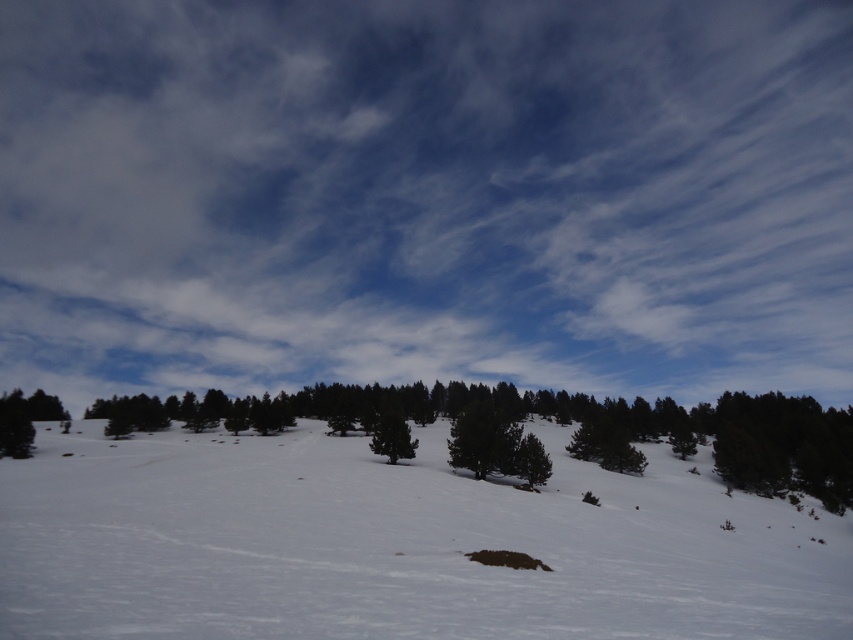
Question: Is white fluffy cloud at upper center positioned before white powdery snow at center?

Choices:
 (A) no
 (B) yes

Answer: (A)

Question: Which point appears farthest from the camera in this image?

Choices:
 (A) (384, 440)
 (B) (440, 51)

Answer: (B)

Question: Which object is positioned farthest from the white powdery snow at center?

Choices:
 (A) white fluffy cloud at upper center
 (B) green matte tree at center

Answer: (A)

Question: Which point appears farthest from the camera in this image?

Choices:
 (A) (485, 76)
 (B) (401, 416)

Answer: (A)

Question: Does white powdery snow at center lie behind green matte tree at center?

Choices:
 (A) no
 (B) yes

Answer: (A)

Question: Can you confirm if white fluffy cloud at upper center is positioned to the right of white powdery snow at center?

Choices:
 (A) yes
 (B) no

Answer: (A)